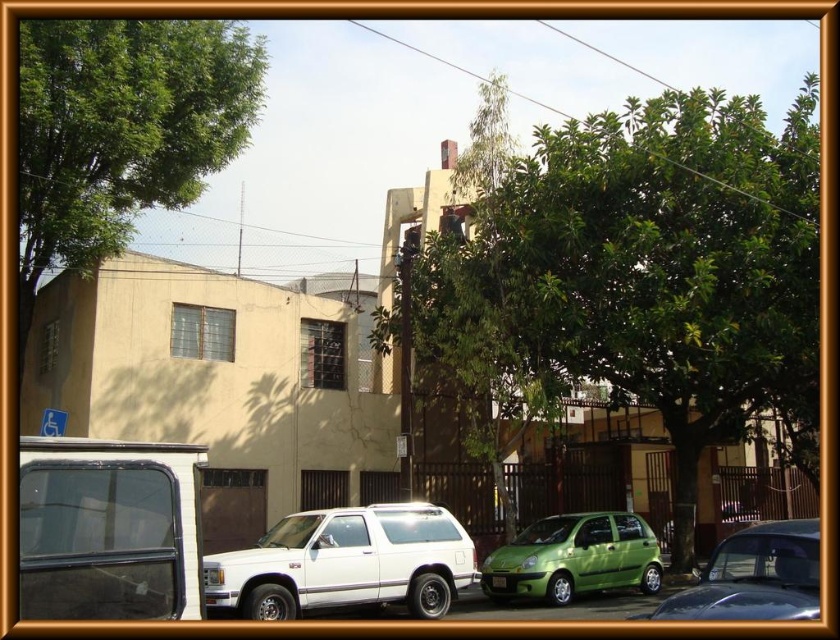
Question: Among these objects, which one is nearest to the camera?

Choices:
 (A) green matte hatchback at center
 (B) green matte hatchback at lower right
 (C) matte black van at lower left

Answer: (C)

Question: Based on their relative distances, which object is nearer to the green matte hatchback at lower right?

Choices:
 (A) green leafy tree at center
 (B) green leafy tree at upper left

Answer: (A)

Question: Is green matte hatchback at center above green matte hatchback at lower right?

Choices:
 (A) no
 (B) yes

Answer: (A)

Question: Is green leafy tree at center thinner than white matte suv at center?

Choices:
 (A) yes
 (B) no

Answer: (B)

Question: Is green leafy tree at center closer to camera compared to white matte suv at center?

Choices:
 (A) yes
 (B) no

Answer: (B)

Question: Based on their relative distances, which object is nearer to the green matte hatchback at center?

Choices:
 (A) green matte hatchback at lower right
 (B) matte black van at lower left
 (C) green leafy tree at center

Answer: (C)